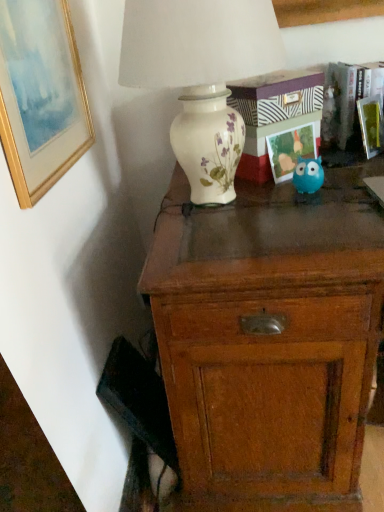
Locate an element on the screen. This screenshot has width=384, height=512. free space in front of matte plastic picture frame at upper right, marked as the 2th picture frame in a right-to-left arrangement is located at coordinates (304, 197).